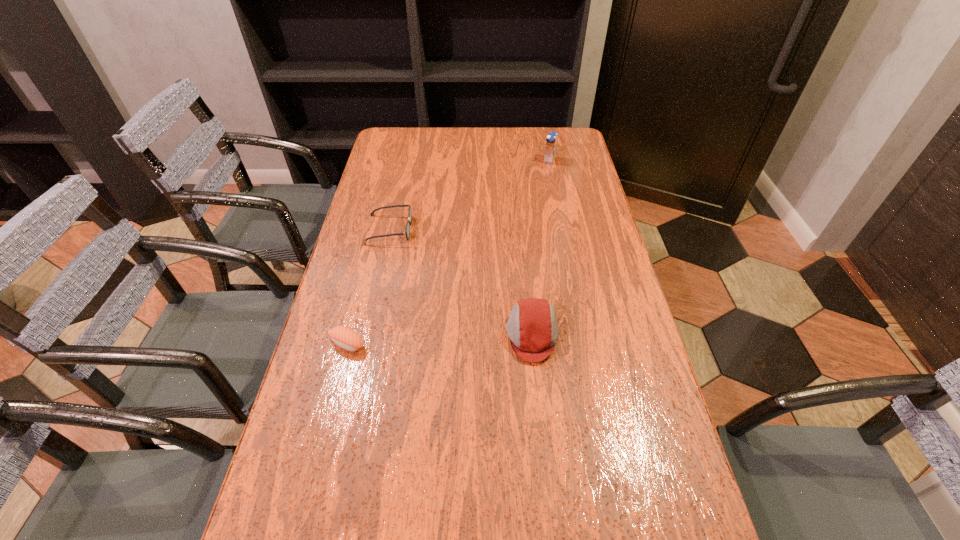
This screenshot has width=960, height=540. Find the location of `the farthest object`. the farthest object is located at coordinates (551, 141).

Find the location of a particular element. The image size is (960, 540). orange_juice is located at coordinates (551, 141).

Find the location of a particular element. cap is located at coordinates (532, 328).

Where is `the second tallest object`? The height and width of the screenshot is (540, 960). the second tallest object is located at coordinates (532, 328).

Locate an element on the screen. spectacles is located at coordinates (407, 229).

In order to click on sushi in this screenshot , I will do `click(345, 337)`.

Where is `free space located 0.090m on the back of the orange_juice`? Image resolution: width=960 pixels, height=540 pixels. free space located 0.090m on the back of the orange_juice is located at coordinates (546, 144).

Locate an element on the screen. The height and width of the screenshot is (540, 960). vacant space located 0.280m on the front-facing side of the third object from left to right is located at coordinates (394, 335).

Image resolution: width=960 pixels, height=540 pixels. I want to click on vacant area located 0.190m on the front-facing side of the third object from left to right, so click(x=429, y=335).

Identify the location of vacant space located 0.150m on the front-facing side of the third object from left to right. The image size is (960, 540). (445, 335).